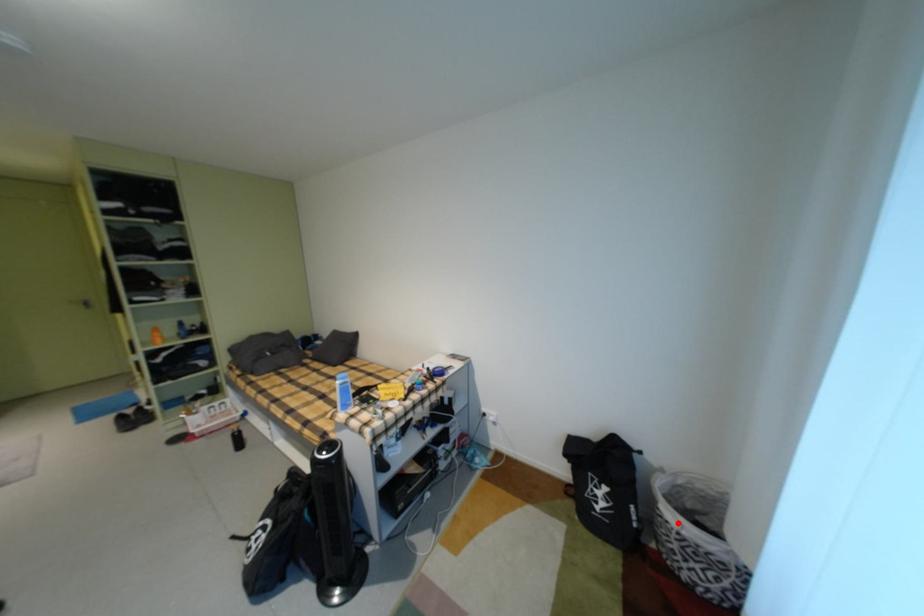
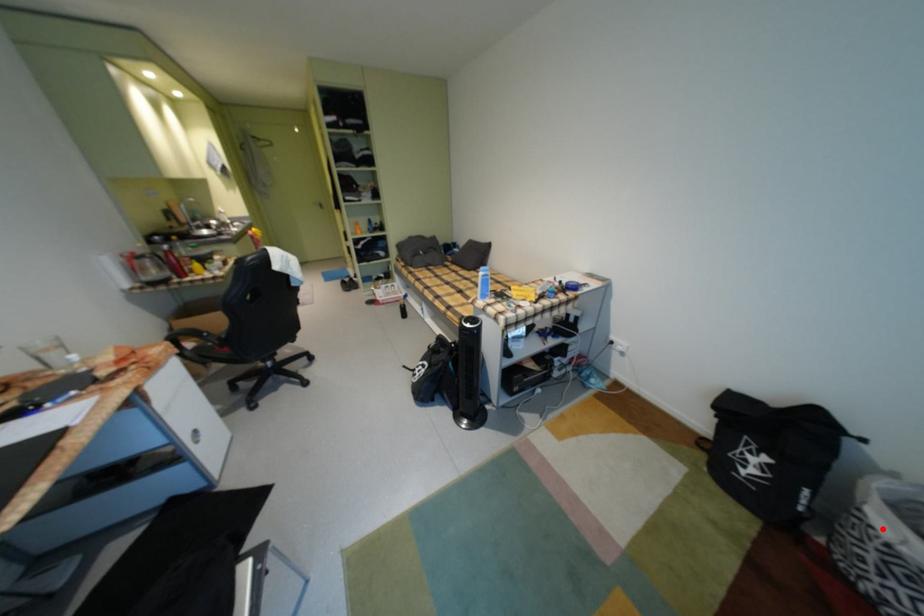
I am providing you with two images of the same scene from different viewpoints. A red point is marked on the first image and another point is marked on the second image. Do the highlighted points in image1 and image2 indicate the same real-world spot?

Yes